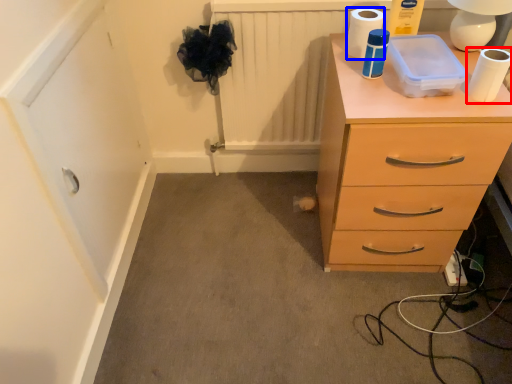
Question: Among these objects, which one is farthest to the camera, toilet paper (highlighted by a red box) or toilet paper (highlighted by a blue box)?

Choices:
 (A) toilet paper
 (B) toilet paper

Answer: (B)